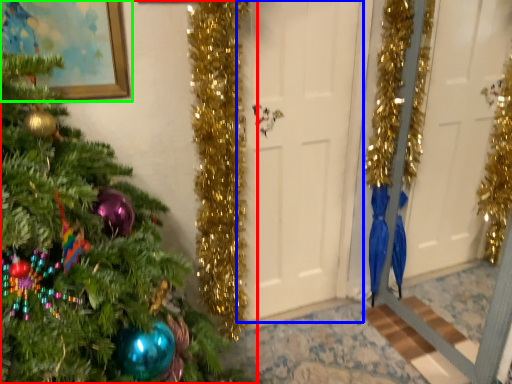
Question: Which object is positioned closest to christmas tree (highlighted by a red box)? Select from door (highlighted by a blue box) and picture frame (highlighted by a green box).

Choices:
 (A) door
 (B) picture frame

Answer: (B)